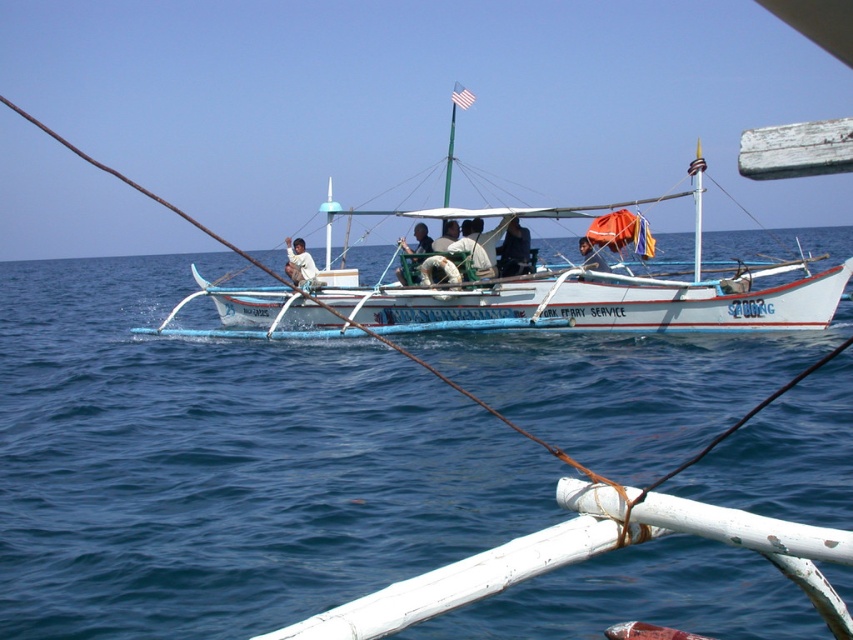
You are a passenger on the banca and want to know where the blue water at center is located relative to the dark blue fabric at center. Can you tell me its position?

The blue water at center is to the left of dark blue fabric at center.

You are a passenger on the white wooden boat at center. You want to move to the front of the boat. Which direction should you go relative to the boat?

The white wooden boat at center is located at coordinates (517, 305), so moving towards the front would mean heading in the direction of the boat that is opposite to its current position. However, without additional information about the boat orientation or the coordinate system, it is impossible to determine the exact direction to move to reach the front.

You are a photographer trying to capture the white wooden boat at center and the light brown woven hat at center in the same frame. Given their sizes, which object should you focus on to ensure both are visible without zooming in or out?

The white wooden boat at center is bigger than the light brown woven hat at center, so you should focus on the white wooden boat at center to ensure both are visible without needing to adjust the zoom.